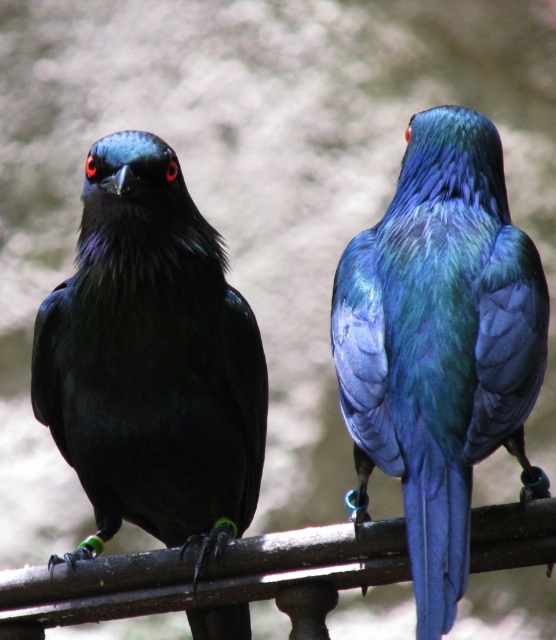
You are standing 2 meters away from a shiny black bird at left. Can you safely approach it without entering its personal space zone, which requires staying at least 2 meters away?

The shiny black bird at left and viewer are 2.16 meters apart from each other. Since the required distance is at least 2 meters, you can safely approach it as you are already within the safe distance.

You are a birder observing two birds on a metal railing. You see the shiny black bird at left and the metallic blue bird at right. Which bird is positioned more to the left side of the railing?

The shiny black bird at left is positioned more to the left side of the railing than the metallic blue bird at right.

You are a birdwatcher observing two birds on a metal railing. You notice the shiny black bird at left and the metallic blue bird at right. Which bird is taller?

The shiny black bird at left is taller than the metallic blue bird at right.